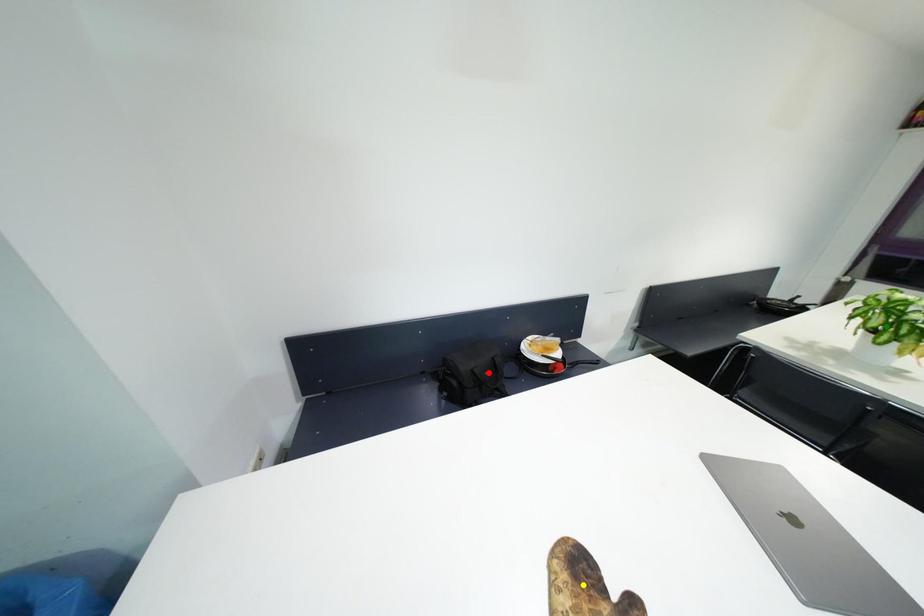
Order these from nearest to farthest:
red point
yellow point
green point

yellow point
red point
green point